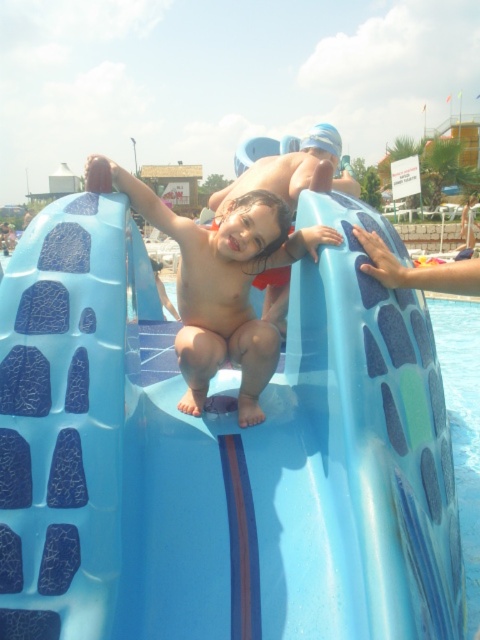
Question: In this image, where is matte blue slide at center located relative to blue glossy water at lower right?

Choices:
 (A) left
 (B) right

Answer: (A)

Question: Estimate the real-world distances between objects in this image. Which object is farther from the blue rubber slide at center?

Choices:
 (A) blue glossy water at lower right
 (B) matte blue slide at center

Answer: (A)

Question: Can you confirm if blue rubber slide at center is smaller than matte blue slide at center?

Choices:
 (A) yes
 (B) no

Answer: (B)

Question: Which point is closer to the camera?

Choices:
 (A) matte blue slide at center
 (B) blue glossy water at lower right

Answer: (A)

Question: Does blue rubber slide at center appear over blue glossy water at lower right?

Choices:
 (A) yes
 (B) no

Answer: (B)

Question: Considering the real-world distances, which object is farthest from the blue glossy water at lower right?

Choices:
 (A) matte blue slide at center
 (B) blue rubber slide at center

Answer: (A)